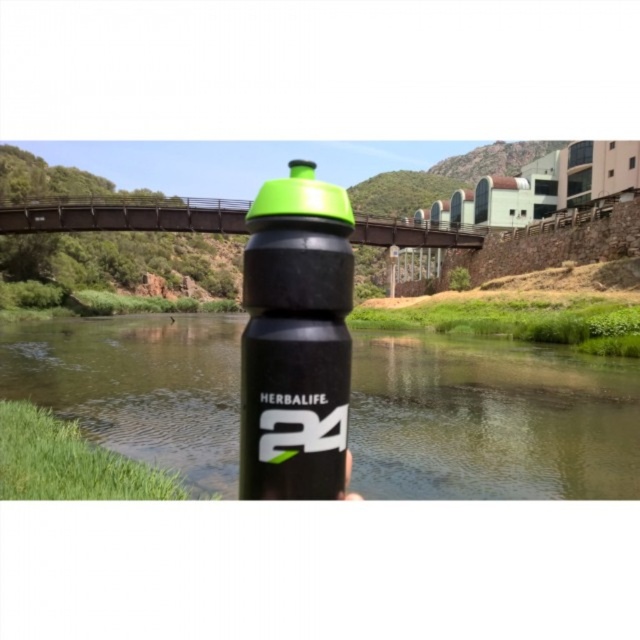
Which of these two, green matte water at center or matte black bottle at center, stands shorter?

green matte water at center

Does green matte water at center have a smaller size compared to matte black bottle at center?

No.

At what (x,y) coordinates should I click in order to perform the action: click on green matte water at center. Please return your answer as a coordinate pair (x, y). Looking at the image, I should click on (490, 420).

Where is `green matte water at center`? green matte water at center is located at coordinates (490, 420).